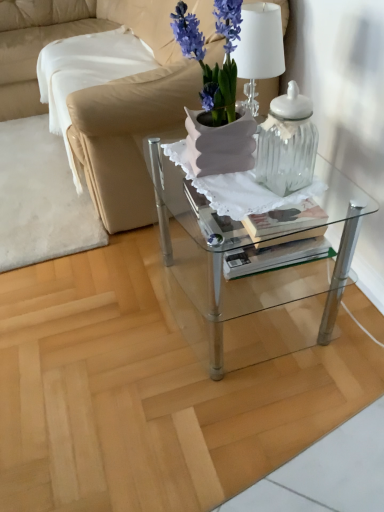
Find the location of `vacant space situated on the left part of clear glass table at center`. vacant space situated on the left part of clear glass table at center is located at coordinates (107, 325).